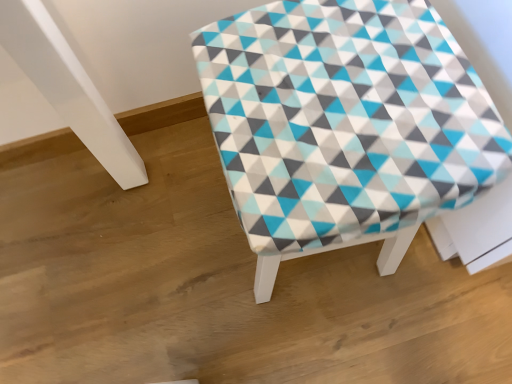
You are a GUI agent. You are given a task and a screenshot of the screen. Output one action in this format:
    pyautogui.click(x=<x>, y=<y>)
    Task: Click on the vacant point above matte fabric stool at center (from a real-world perspective)
    This screenshot has width=512, height=384.
    Given the screenshot: What is the action you would take?
    pyautogui.click(x=352, y=92)